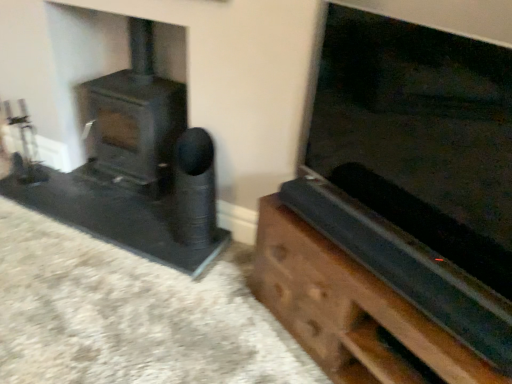
In order to click on vacant area that is in front of matte black wood burning stove at left in this screenshot , I will do `click(117, 218)`.